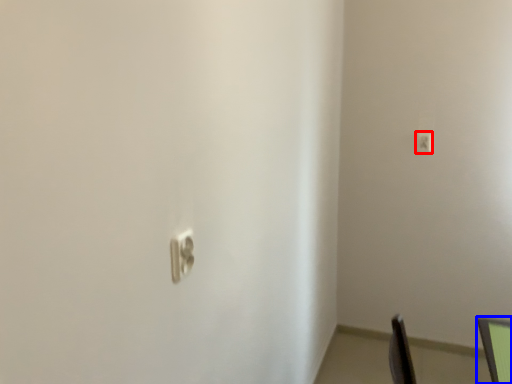
Question: Which of the following is the farthest to the observer, light switch (highlighted by a red box) or computer monitor (highlighted by a blue box)?

Choices:
 (A) light switch
 (B) computer monitor

Answer: (A)